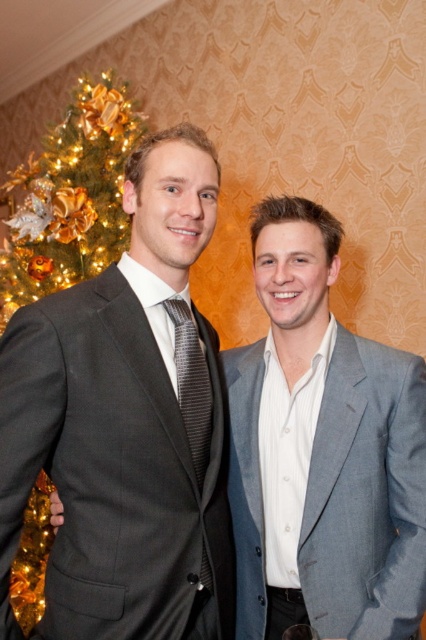
You are a photographer setting up a camera at position point 0.5, 0.5. You need to focus on the gray fabric suit at center. What direction should you adjust your camera to get the subject in focus?

The gray fabric suit at center is located at point (322, 451), so you should adjust the camera upwards and to the right from point (213, 320) to focus on it.

You are a photographer setting up for a group photo. You need to ensure that the matte gray suit at left and the shiny gold ornaments at left are both in focus. The camera can focus on objects within a 3 feet range. Can both subjects be in focus at the same time?

The matte gray suit at left is 3.73 feet away from the shiny gold ornaments at left. Since the distance between them is greater than 3 feet, the camera cannot keep both in focus simultaneously within the 3 feet range.

You are a photographer setting up for a group photo. You need to ensure that the shiny gold ornaments at left and the black striped tie at center are both clearly visible in the frame. Given that your camera has a minimum focus distance of 1.2 meters, will you be able to capture both objects in focus without moving the camera closer?

The distance between the shiny gold ornaments at left and the black striped tie at center is 1.12 meters. Since the camera requires a minimum focus distance of 1.2 meters to keep both objects in focus, the current distance is insufficient. Moving the camera closer would reduce the distance between the objects, potentially allowing both to be in focus.